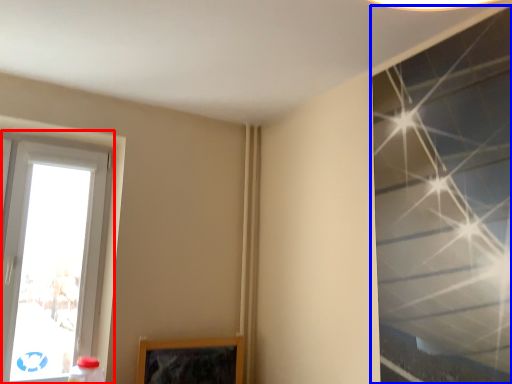
Question: Which point is closer to the camera, window (highlighted by a red box) or window (highlighted by a blue box)?

Choices:
 (A) window
 (B) window

Answer: (B)